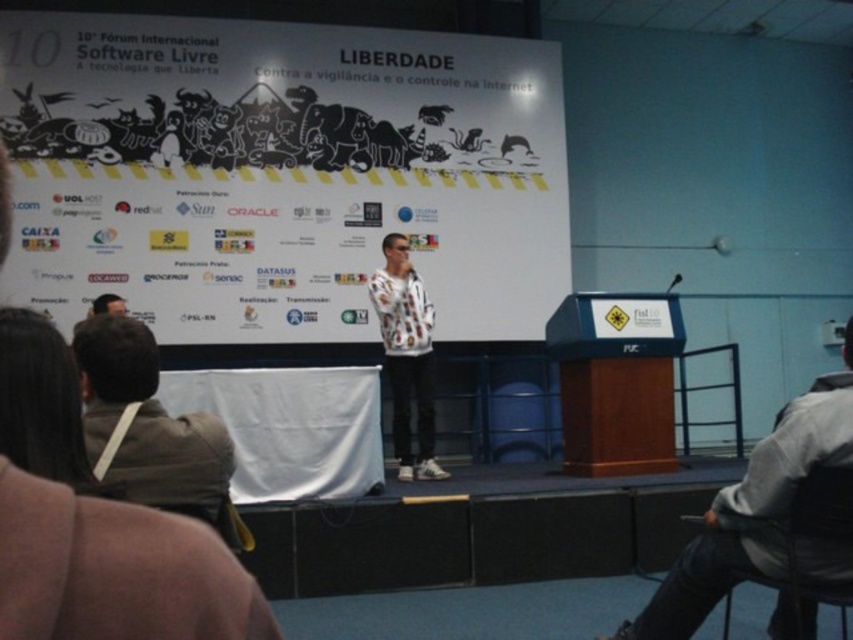
Question: Among these objects, which one is nearest to the camera?

Choices:
 (A) gray fabric jacket at lower right
 (B) white paper at center

Answer: (A)

Question: Based on their relative distances, which object is nearer to the white paper at center?

Choices:
 (A) brown leather jacket at lower left
 (B) white printed sweater at center
 (C) black plastic chair at lower right

Answer: (B)

Question: Can you confirm if white paper at center is positioned to the left of white printed sweater at center?

Choices:
 (A) yes
 (B) no

Answer: (A)

Question: Estimate the real-world distances between objects in this image. Which object is closer to the gray fabric jacket at lower right?

Choices:
 (A) white printed sweater at center
 (B) white paper at center

Answer: (A)

Question: Does gray fabric jacket at lower right appear on the left side of brown leather jacket at lower left?

Choices:
 (A) yes
 (B) no

Answer: (B)

Question: Is white paper at center below gray fabric jacket at lower right?

Choices:
 (A) yes
 (B) no

Answer: (B)